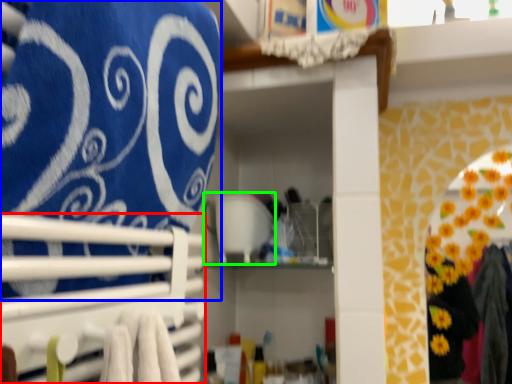
Question: Considering the real-world distances, which object is farthest from closet (highlighted by a red box)? bath towel (highlighted by a blue box) or appliance (highlighted by a green box)?

Choices:
 (A) bath towel
 (B) appliance

Answer: (B)